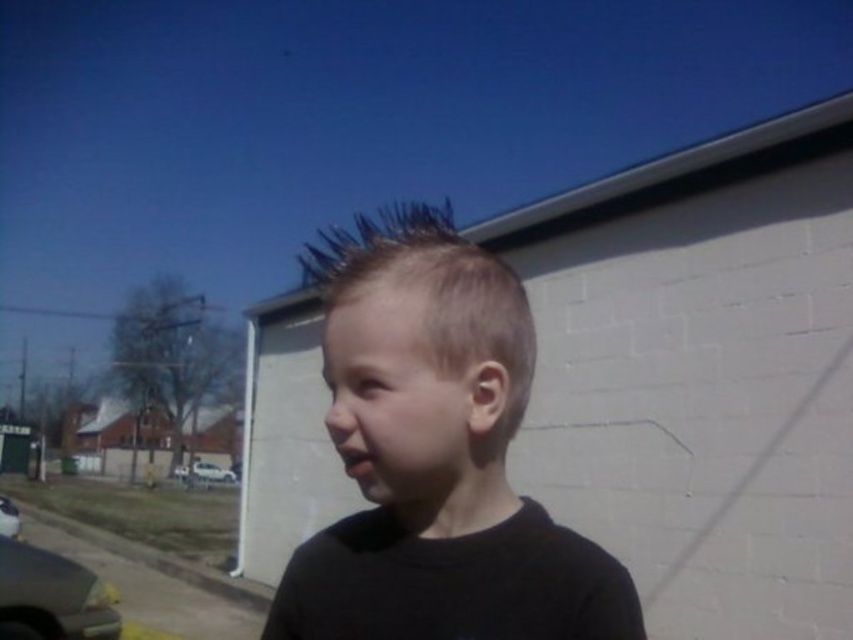
Question: Which point is farther to the camera?

Choices:
 (A) (456, 248)
 (B) (71, 577)
 (C) (456, 300)

Answer: (B)

Question: Does slicked blue plastic hair at center appear on the left side of metallic gray car at lower left?

Choices:
 (A) yes
 (B) no

Answer: (B)

Question: Can you confirm if metallic gray car at lower left is positioned to the right of metallic silver car at lower left?

Choices:
 (A) yes
 (B) no

Answer: (A)

Question: Where is metallic gray car at lower left located in relation to metallic silver car at lower left in the image?

Choices:
 (A) above
 (B) below

Answer: (A)

Question: Which of the following is the closest to the observer?

Choices:
 (A) (177, 476)
 (B) (511, 614)
 (C) (7, 522)
 (D) (54, 605)

Answer: (B)

Question: Which point is closer to the camera?

Choices:
 (A) blonde hair at center
 (B) metallic gray car at lower left
 (C) metallic silver car at lower left
 (D) silver metallic car at lower left

Answer: (A)